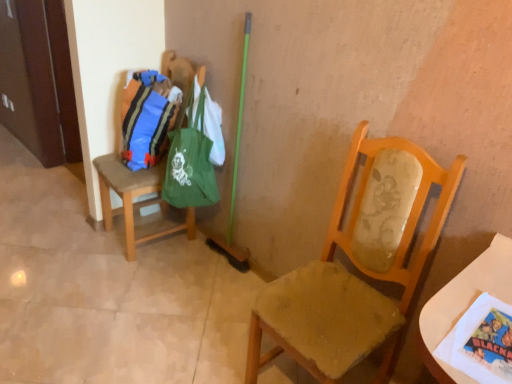
Question: From the image's perspective, is matte blue fabric bag at left, the 2th bag in the right-to-left sequence, located above or below brown fabric chair at left, placed as the first chair when sorted from left to right?

Choices:
 (A) below
 (B) above

Answer: (B)

Question: Considering the positions of point (130, 107) and point (165, 203), is point (130, 107) closer or farther from the camera than point (165, 203)?

Choices:
 (A) farther
 (B) closer

Answer: (B)

Question: Which is nearer to the wooden chair at center, positioned as the 2th chair in left-to-right order?

Choices:
 (A) brown fabric chair at left, acting as the 1th chair starting from the back
 (B) matte blue fabric bag at left, placed as the first bag when sorted from left to right
 (C) green fabric bag at upper left, marked as the second bag in a left-to-right arrangement
 (D) white paper at lower right

Answer: (D)

Question: Estimate the real-world distances between objects in this image. Which object is closer to the wooden chair at center, which is the 2th chair in back-to-front order?

Choices:
 (A) green fabric bag at upper left, marked as the second bag in a left-to-right arrangement
 (B) matte blue fabric bag at left, the 2th bag in the right-to-left sequence
 (C) brown fabric chair at left, placed as the first chair when sorted from left to right
 (D) white paper at lower right

Answer: (D)